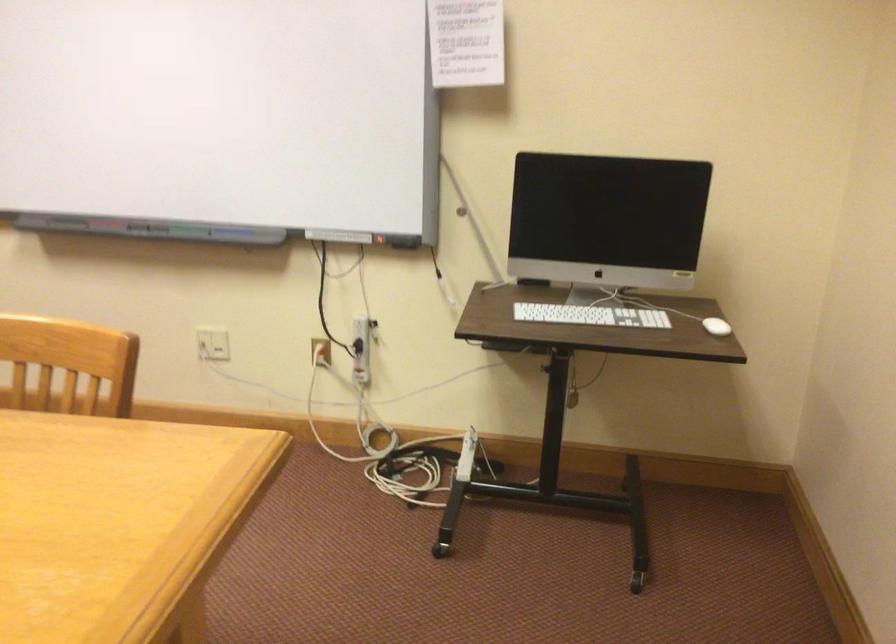
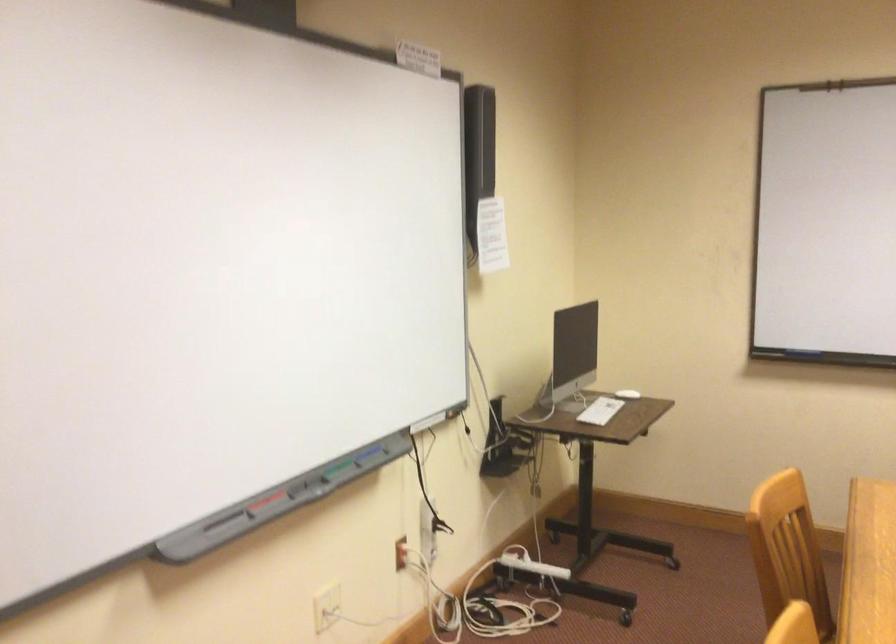
Where in the second image is the point corresponding to point (563, 310) from the first image?

(600, 410)